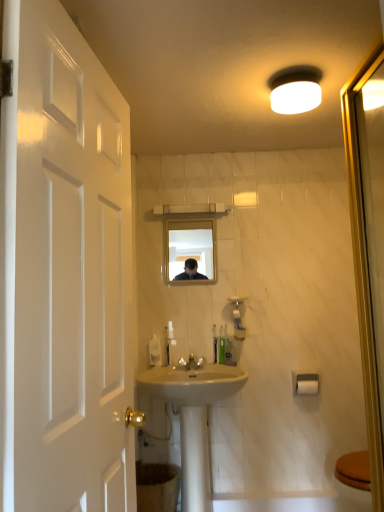
The image size is (384, 512). I want to click on green plastic toothbrush at center, so click(x=214, y=343).

In the scene shown: Measure the distance between white glossy faucet at center and camera.

The depth of white glossy faucet at center is 8.16 feet.

The height and width of the screenshot is (512, 384). In order to click on translucent plastic toothbrush at center, which is counted as the first toiletry, starting from the right in this screenshot , I will do `click(227, 346)`.

This screenshot has width=384, height=512. What do you see at coordinates (157, 487) in the screenshot?
I see `brown textured toilet bowl at lower center` at bounding box center [157, 487].

What is the approximate height of white matte light fixture at upper center?

white matte light fixture at upper center is 10.27 centimeters tall.

Where is `white matte toilet paper at lower right`? This screenshot has width=384, height=512. white matte toilet paper at lower right is located at coordinates (307, 386).

From the image's perspective, is white ceramic sink at center positioned above or below white matte light fixture at upper center?

white ceramic sink at center is situated lower than white matte light fixture at upper center in the image.

From a real-world perspective, is white ceramic sink at center beneath white matte light fixture at upper center?

Yes, from a real-world perspective, white ceramic sink at center is under white matte light fixture at upper center.

Considering the sizes of white ceramic sink at center and white matte light fixture at upper center in the image, is white ceramic sink at center bigger or smaller than white matte light fixture at upper center?

Considering their sizes, white ceramic sink at center takes up more space than white matte light fixture at upper center.

In terms of width, does white matte light fixture at upper center look wider or thinner when compared to translucent plastic soap dispenser at center, the first toiletry viewed from the left?

In the image, white matte light fixture at upper center appears to be wider than translucent plastic soap dispenser at center, the first toiletry viewed from the left.

Can you confirm if white matte light fixture at upper center is positioned to the right of translucent plastic soap dispenser at center, the first toiletry viewed from the left?

Correct, you'll find white matte light fixture at upper center to the right of translucent plastic soap dispenser at center, the first toiletry viewed from the left.

Does point (298, 109) come closer to viewer compared to point (223, 359)?

Yes, point (298, 109) is in front of point (223, 359).

Which is more to the right, clear glass mirror at center or brown textured toilet bowl at lower center?

From the viewer's perspective, clear glass mirror at center appears more on the right side.

Does point (204, 236) appear closer or farther from the camera than point (150, 501)?

Point (204, 236) is farther from the camera than point (150, 501).

From a real-world perspective, is clear glass mirror at center positioned over brown textured toilet bowl at lower center based on gravity?

Yes.

Can you confirm if clear glass mirror at center is taller than brown textured toilet bowl at lower center?

Yes.

Looking at their sizes, would you say white plastic soap dispenser at center is wider or thinner than white glossy faucet at center?

Clearly, white plastic soap dispenser at center has less width compared to white glossy faucet at center.

From the image's perspective, which object appears higher, white plastic soap dispenser at center or white glossy faucet at center?

From the image's view, white plastic soap dispenser at center is above.

Looking at this image, how many degrees apart are the facing directions of white plastic soap dispenser at center and white glossy faucet at center?

The facing directions of white plastic soap dispenser at center and white glossy faucet at center are 0.00205 degrees apart.

Is white plastic soap dispenser at center positioned with its back to white glossy faucet at center?

That's not correct — white plastic soap dispenser at center is not looking away from white glossy faucet at center.

Considering the relative positions of white glossy door at left and white ceramic sink at center in the image provided, is white glossy door at left to the left or to the right of white ceramic sink at center?

Clearly, white glossy door at left is on the left of white ceramic sink at center in the image.

Which of these two, white glossy door at left or white ceramic sink at center, is wider?

white ceramic sink at center.

Image resolution: width=384 pixels, height=512 pixels. I want to click on door lying on the left of white ceramic sink at center, so click(64, 272).

Does white glossy door at left turn towards white ceramic sink at center?

No, white glossy door at left is not facing towards white ceramic sink at center.

Considering the positions of point (214, 336) and point (152, 362), is point (214, 336) closer or farther from the camera than point (152, 362)?

Point (214, 336).

From the image's perspective, is green plastic toothbrush at center located beneath white plastic soap dispenser at center?

No.

The height and width of the screenshot is (512, 384). I want to click on toothbrush above the white plastic soap dispenser at center (from the image's perspective), so click(214, 343).

Can you tell me how much green plastic toothbrush at center and white plastic soap dispenser at center differ in facing direction?

green plastic toothbrush at center and white plastic soap dispenser at center are facing 3.49 degrees away from each other.

Considering the sizes of green plastic toothbrush at center and translucent plastic toothbrush at center, arranged as the 2th toiletry when viewed from the left, in the image, is green plastic toothbrush at center bigger or smaller than translucent plastic toothbrush at center, arranged as the 2th toiletry when viewed from the left,?

Considering their sizes, green plastic toothbrush at center takes up more space than translucent plastic toothbrush at center, arranged as the 2th toiletry when viewed from the left.

Considering their positions, is green plastic toothbrush at center located in front of or behind translucent plastic toothbrush at center, arranged as the 2th toiletry when viewed from the left?

green plastic toothbrush at center is positioned closer to the viewer than translucent plastic toothbrush at center, arranged as the 2th toiletry when viewed from the left.

From a real-world perspective, who is located higher, green plastic toothbrush at center or translucent plastic toothbrush at center, which is counted as the first toiletry, starting from the right?

In real-world perspective, translucent plastic toothbrush at center, which is counted as the first toiletry, starting from the right, is above.

Looking at this image, is translucent plastic toothbrush at center, arranged as the 2th toiletry when viewed from the left, at the back of green plastic toothbrush at center?

That's not correct — green plastic toothbrush at center is not looking away from translucent plastic toothbrush at center, arranged as the 2th toiletry when viewed from the left.

At what (x,y) coordinates should I click in order to perform the action: click on sink that is behind the white matte light fixture at upper center. Please return your answer as a coordinate pair (x, y). Looking at the image, I should click on (193, 419).

This screenshot has width=384, height=512. In order to click on the 2nd toiletry positioned below the white matte light fixture at upper center (from a real-world perspective) in this screenshot , I will do [x=221, y=346].

Based on their spatial positions, is white ceramic sink at center or brown textured toilet bowl at lower center closer to white glossy door at left?

white ceramic sink at center.

Which object lies further to the anchor point white matte light fixture at upper center, white ceramic sink at center or clear glass mirror at center?

clear glass mirror at center is positioned further to the anchor white matte light fixture at upper center.

From the image, which object appears to be farther from translucent plastic toothbrush at center, which is counted as the first toiletry, starting from the right, white matte toilet paper at lower right or white plastic soap dispenser at center?

Based on the image, white matte toilet paper at lower right appears to be further to translucent plastic toothbrush at center, which is counted as the first toiletry, starting from the right.

Looking at this image, from the image, which object appears to be nearer to translucent plastic soap dispenser at center, the first toiletry viewed from the left, white matte light fixture at upper center or white matte toilet paper at lower right?

white matte toilet paper at lower right is positioned closer to the anchor translucent plastic soap dispenser at center, the first toiletry viewed from the left.

From the image, which object appears to be farther from white matte toilet paper at lower right, green plastic toothbrush at center or translucent plastic soap dispenser at center, placed as the second toiletry when sorted from right to left?

green plastic toothbrush at center lies further to white matte toilet paper at lower right than the other object.

When comparing their distances from translucent plastic soap dispenser at center, placed as the second toiletry when sorted from right to left, does white glossy faucet at center or white matte light fixture at upper center seem further?

white matte light fixture at upper center.

From the picture: Based on their spatial positions, is white glossy faucet at center or brown textured toilet bowl at lower center further from green plastic toothbrush at center?

brown textured toilet bowl at lower center is positioned further to the anchor green plastic toothbrush at center.

Considering their positions, is brown textured toilet bowl at lower center positioned closer to clear glass mirror at center than white glossy faucet at center?

The object closer to clear glass mirror at center is white glossy faucet at center.

Locate an element on the screen. Image resolution: width=384 pixels, height=512 pixels. light fixture positioned between white glossy door at left and white glossy faucet at center from near to far is located at coordinates [295, 89].

Where is `sink between white plastic soap dispenser at center and white matte toilet paper at lower right`? Image resolution: width=384 pixels, height=512 pixels. sink between white plastic soap dispenser at center and white matte toilet paper at lower right is located at coordinates (193, 419).

Find the location of `tap between clear glass mirror at center and white ceramic sink at center in the up-down direction`. tap between clear glass mirror at center and white ceramic sink at center in the up-down direction is located at coordinates (190, 362).

Find the location of a particular element. The height and width of the screenshot is (512, 384). tap between white glossy door at left and white matte toilet paper at lower right in the front-back direction is located at coordinates (190, 362).